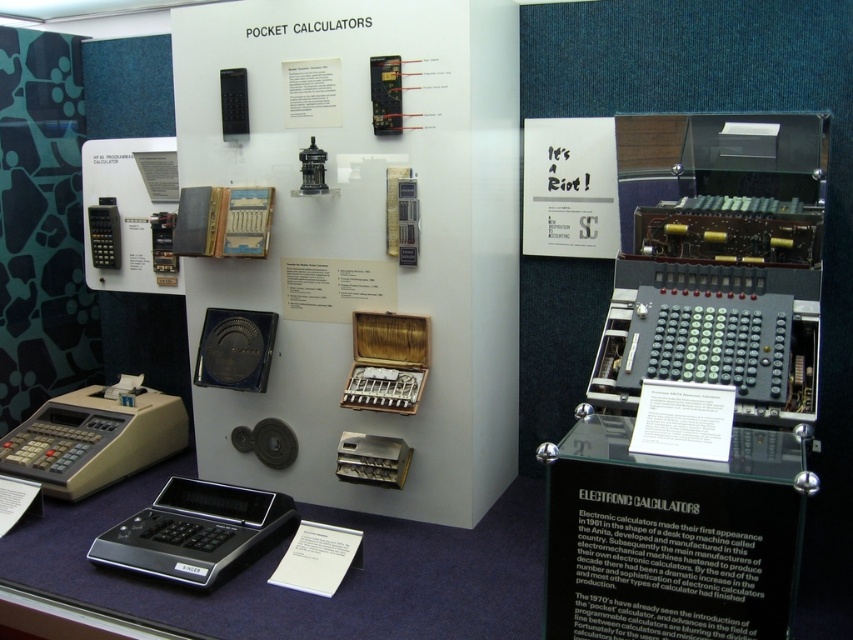
Question: Does beige plastic cash register at lower left lie in front of black plastic calculator at lower left?

Choices:
 (A) yes
 (B) no

Answer: (B)

Question: Which point is farther to the camera?

Choices:
 (A) beige plastic cash register at lower left
 (B) black plastic calculator at lower left

Answer: (A)

Question: Is beige plastic cash register at lower left bigger than black plastic calculator at lower left?

Choices:
 (A) no
 (B) yes

Answer: (B)

Question: Can you confirm if beige plastic cash register at lower left is positioned to the left of black plastic calculator at lower left?

Choices:
 (A) yes
 (B) no

Answer: (A)